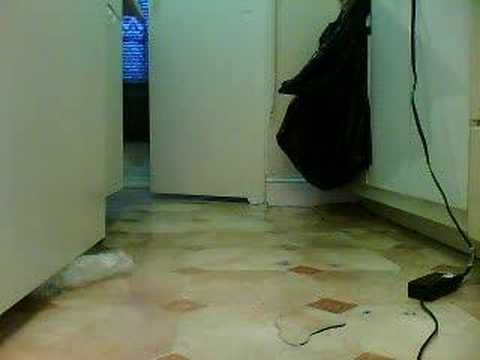
You are a GUI agent. You are given a task and a screenshot of the screen. Output one action in this format:
    pyautogui.click(x=<x>, y=<y>)
    Task: Click on the white blurry object under the cabinet
    The height and width of the screenshot is (360, 480).
    Given the screenshot: What is the action you would take?
    pyautogui.click(x=86, y=268)